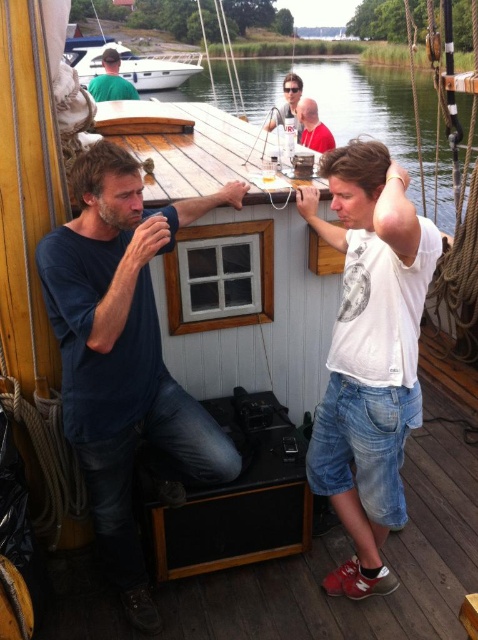
Question: Does wooden table at center appear over red shirt at upper center?

Choices:
 (A) no
 (B) yes

Answer: (B)

Question: Does blue cotton shirt at left appear on the left side of red shirt at upper center?

Choices:
 (A) yes
 (B) no

Answer: (A)

Question: Among these points, which one is farthest from the camera?

Choices:
 (A) (286, 88)
 (B) (128, 68)
 (C) (330, 170)

Answer: (B)

Question: Is white cotton t-shirt at center behind red shirt at upper center?

Choices:
 (A) no
 (B) yes

Answer: (A)

Question: Which point appears farthest from the camera in this image?

Choices:
 (A) (66, 52)
 (B) (104, 356)
 (C) (361, 90)

Answer: (C)

Question: Among these objects, which one is farthest from the camera?

Choices:
 (A) white glossy boat at upper center
 (B) white cotton t-shirt at center

Answer: (A)